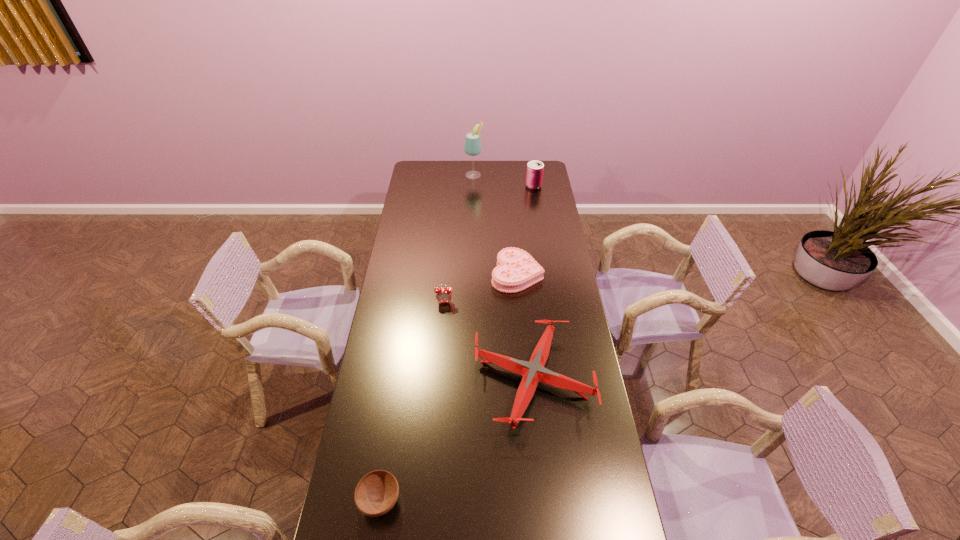
The width and height of the screenshot is (960, 540). Identify the location of alcohol. (472, 146).

Image resolution: width=960 pixels, height=540 pixels. What are the coordinates of `the tallest object` in the screenshot? It's located at (472, 146).

The image size is (960, 540). Identify the location of can. (534, 176).

Find the location of a particular element. the fifth shortest object is located at coordinates (534, 176).

This screenshot has width=960, height=540. What are the coordinates of `alarm clock` in the screenshot? It's located at (443, 295).

The width and height of the screenshot is (960, 540). I want to click on the second object from left to right, so click(443, 295).

This screenshot has width=960, height=540. Identify the location of the second nearest object. (533, 372).

Image resolution: width=960 pixels, height=540 pixels. I want to click on bowl, so click(x=376, y=493).

In order to click on the nearest object in this screenshot , I will do `click(376, 493)`.

Locate an element on the screen. cake is located at coordinates (516, 270).